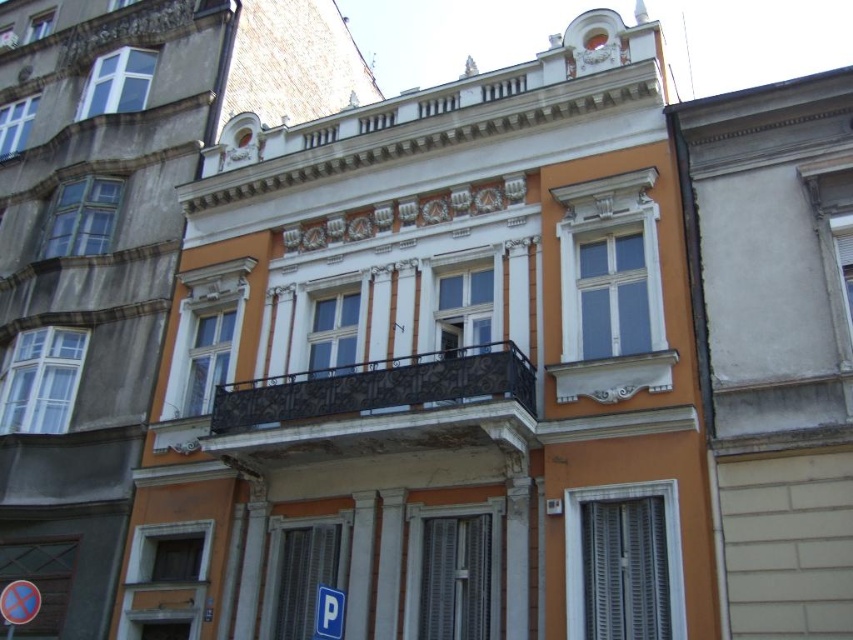
Which is above, black wrought iron balcony at center or blue plastic parking sign at lower center?

Positioned higher is black wrought iron balcony at center.

What are the coordinates of `black wrought iron balcony at center` in the screenshot? It's located at (372, 406).

Is point (227, 394) more distant than point (323, 630)?

That is True.

Locate an element on the screen. The height and width of the screenshot is (640, 853). black wrought iron balcony at center is located at coordinates (372, 406).